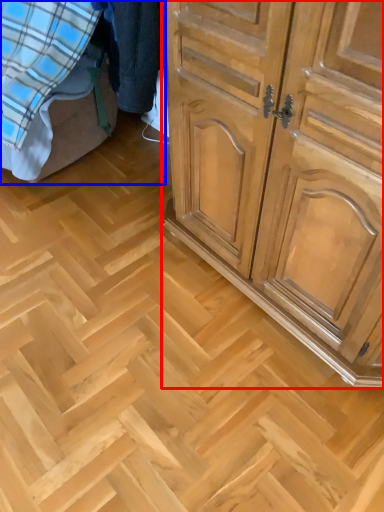
Question: Which of the following is the farthest to the observer, chest of drawers (highlighted by a red box) or bed (highlighted by a blue box)?

Choices:
 (A) chest of drawers
 (B) bed

Answer: (B)